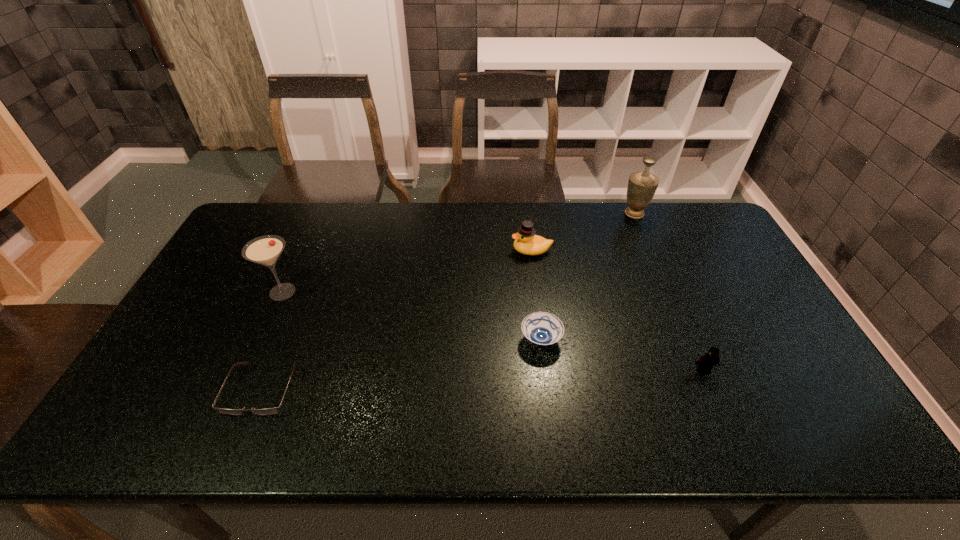
This screenshot has width=960, height=540. I want to click on the farthest object, so click(642, 185).

Find the location of a particular element. Image resolution: width=960 pixels, height=540 pixels. urn is located at coordinates (642, 185).

Identify the location of the second tallest object. pos(265,250).

Image resolution: width=960 pixels, height=540 pixels. I want to click on the third farthest object, so click(265, 250).

Where is `duck`? The height and width of the screenshot is (540, 960). duck is located at coordinates (527, 243).

This screenshot has width=960, height=540. Identify the location of the third tallest object. (527, 243).

The height and width of the screenshot is (540, 960). Identify the location of Lego. (705, 364).

Find the location of `soup bowl`. soup bowl is located at coordinates coord(541,328).

Find the location of a particular element. the third nearest object is located at coordinates (541, 328).

Where is `spectacles`? This screenshot has width=960, height=540. spectacles is located at coordinates (268, 411).